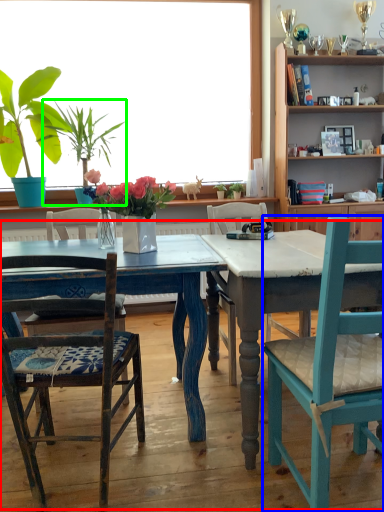
Question: Estimate the real-world distances between objects in this image. Which object is farther from kitchen & dining room table (highlighted by a red box), chair (highlighted by a blue box) or houseplant (highlighted by a green box)?

Choices:
 (A) chair
 (B) houseplant

Answer: (B)